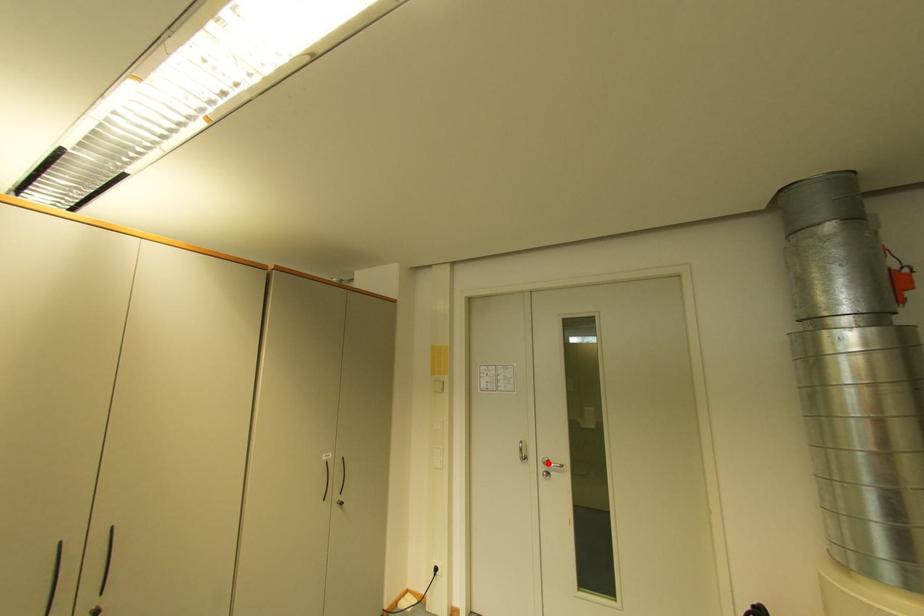
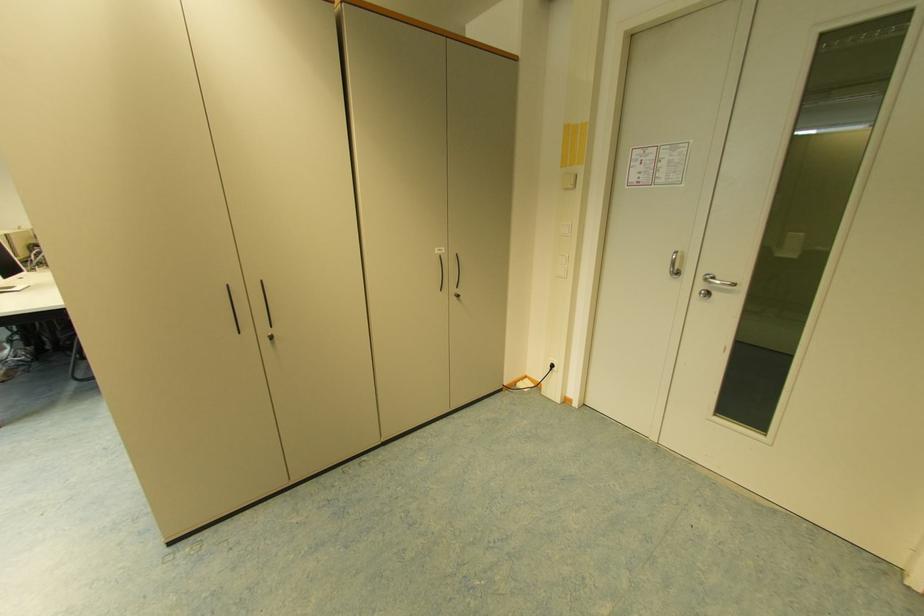
The point at the highlighted location is marked in the first image. Where is the corresponding point in the second image?

(710, 280)